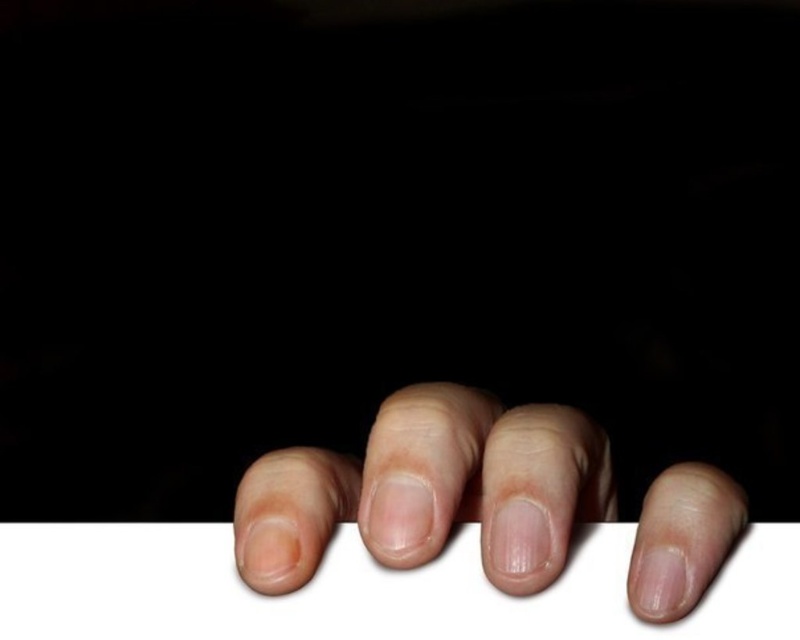
Locate an element on the screen. white matte paper at bottom is located at coordinates (362, 589).

Can you confirm if white matte paper at bottom is shorter than smooth skin hand at lower center?

Correct, white matte paper at bottom is not as tall as smooth skin hand at lower center.

Locate an element on the screen. The height and width of the screenshot is (640, 800). white matte paper at bottom is located at coordinates (362, 589).